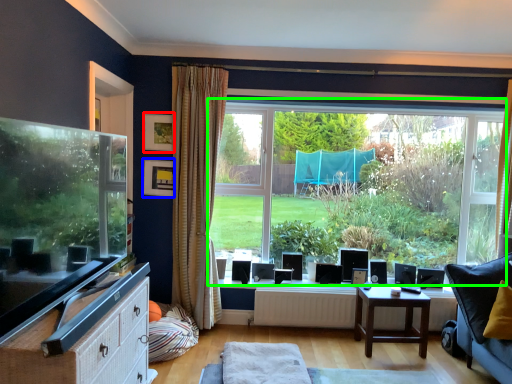
Question: Which is nearer to the picture frame (highlighted by a red box)? picture frame (highlighted by a blue box) or window (highlighted by a green box).

Choices:
 (A) picture frame
 (B) window

Answer: (A)